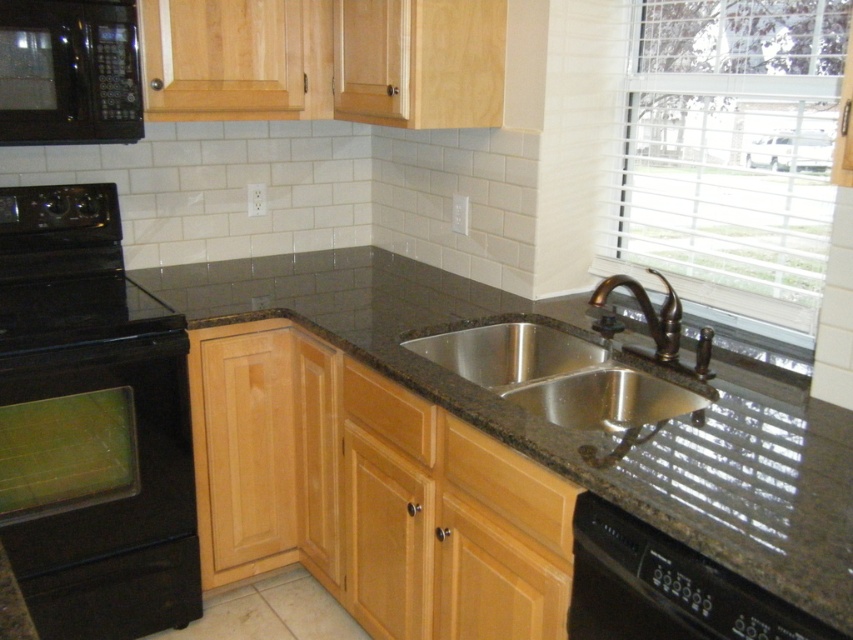
Question: Which point is closer to the camera?

Choices:
 (A) wooden drawer at center
 (B) brown granite countertop at lower center
 (C) stainless steel sink at center

Answer: (C)

Question: Which point appears closest to the camera in this image?

Choices:
 (A) (498, 488)
 (B) (646, 314)

Answer: (A)

Question: Is granite at center above black matte microwave at upper left?

Choices:
 (A) yes
 (B) no

Answer: (B)

Question: Is the position of granite at center more distant than that of black glossy oven at left?

Choices:
 (A) yes
 (B) no

Answer: (B)

Question: Is granite at center thinner than bronze metallic faucet at sink right?

Choices:
 (A) no
 (B) yes

Answer: (A)

Question: Which object is the farthest from the wooden drawer at lower center?

Choices:
 (A) wooden drawer at center
 (B) bronze metallic faucet at sink right
 (C) stainless steel sink at center

Answer: (B)